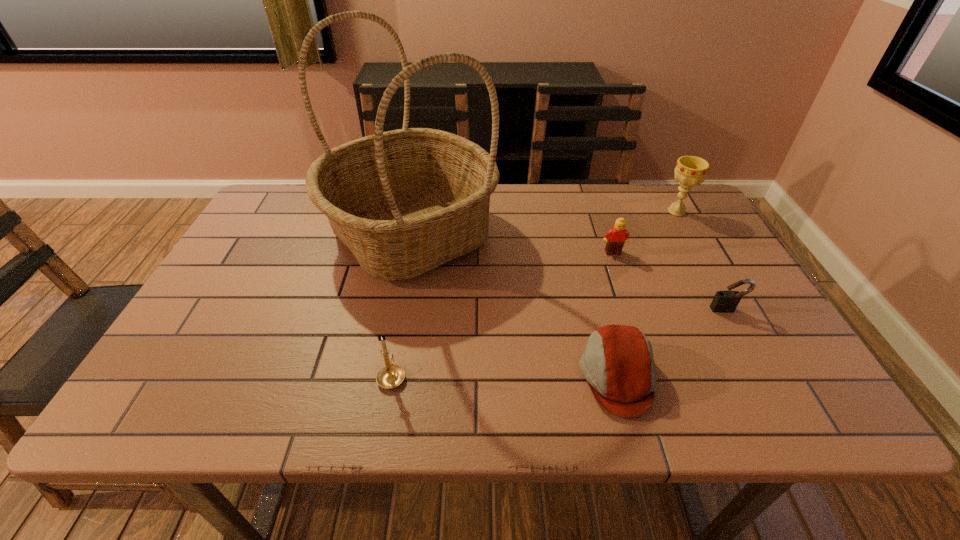
Where is `vacant space situated on the handle side of the fourth shortest object`? This screenshot has height=540, width=960. vacant space situated on the handle side of the fourth shortest object is located at coordinates (412, 259).

Where is `free region located 0.140m on the face of the Lego`? free region located 0.140m on the face of the Lego is located at coordinates (627, 293).

You are a GUI agent. You are given a task and a screenshot of the screen. Output one action in this format:
    pyautogui.click(x=<x>, y=<y>)
    Task: Click on the vacant point located 0.240m with the keyhole on the front of the third nearest object
    
    Given the screenshot: What is the action you would take?
    pyautogui.click(x=780, y=405)

This screenshot has height=540, width=960. Find the location of `vacant region located on the front-facing side of the cap`. vacant region located on the front-facing side of the cap is located at coordinates (397, 376).

In order to click on free point located on the front-facing side of the cap in this screenshot , I will do `click(540, 376)`.

Where is `vacant space situated on the front-facing side of the cap`? vacant space situated on the front-facing side of the cap is located at coordinates (403, 376).

You are a GUI agent. You are given a task and a screenshot of the screen. Output one action in this format:
    pyautogui.click(x=<x>, y=<y>)
    Task: Click on the basket that is at the far edge
    The width and height of the screenshot is (960, 540).
    Given the screenshot: What is the action you would take?
    pyautogui.click(x=406, y=201)

The height and width of the screenshot is (540, 960). In order to click on chalice at the far edge in this screenshot , I will do `click(690, 170)`.

The height and width of the screenshot is (540, 960). I want to click on candle holder present at the near edge, so click(x=390, y=376).

Image resolution: width=960 pixels, height=540 pixels. What are the coordinates of `cap present at the near edge` in the screenshot? It's located at (618, 364).